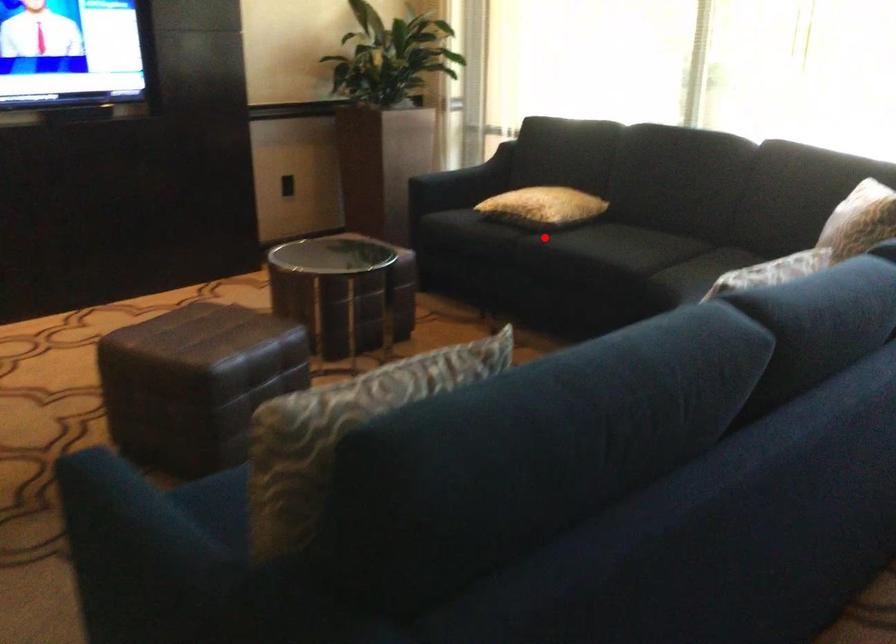
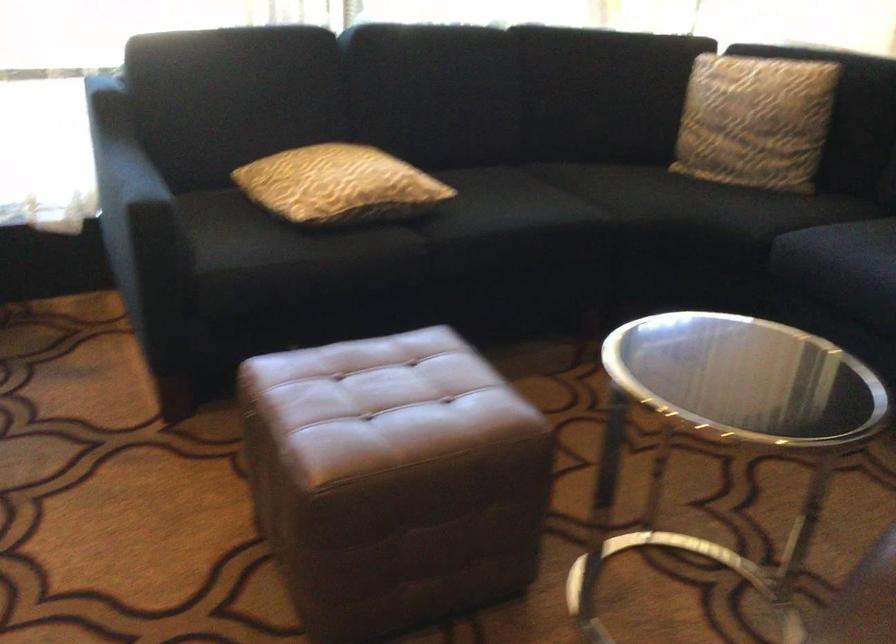
Question: I am providing you with two images of the same scene from different viewpoints. Given a red point in image1, look at the same physical point in image2. Is it:

Choices:
 (A) Closer to the viewpoint
 (B) Farther from the viewpoint

Answer: (A)